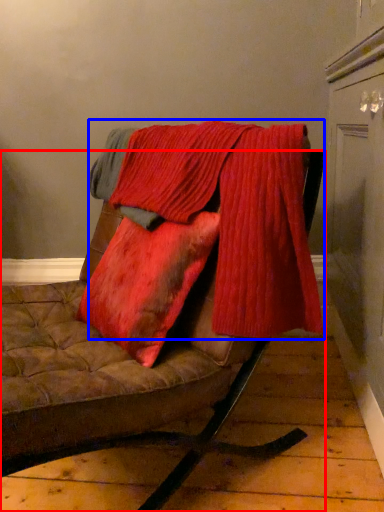
Question: Which object appears closest to the camera in this image, furniture (highlighted by a red box) or laundry (highlighted by a blue box)?

Choices:
 (A) furniture
 (B) laundry

Answer: (A)